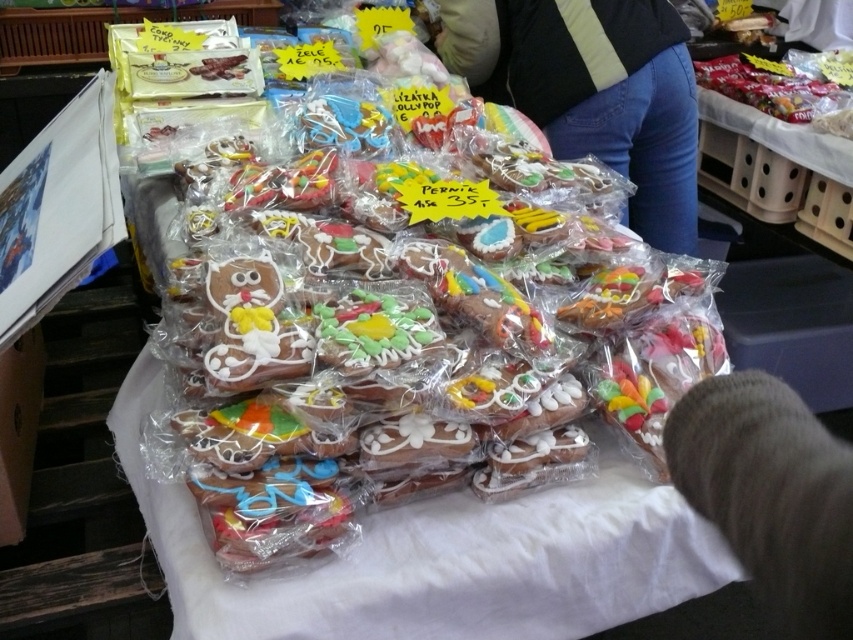
Does blue jeans at center have a smaller size compared to fuzzy gray hair at lower right?

Actually, blue jeans at center might be larger than fuzzy gray hair at lower right.

Where is `blue jeans at center`? blue jeans at center is located at coordinates (595, 92).